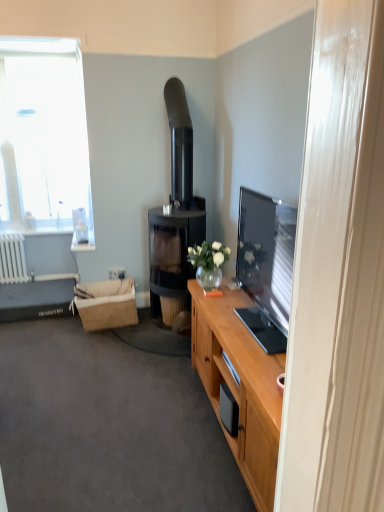
Locate an element on the screen. The image size is (384, 512). vacant space in front of burlap picnic basket at lower left is located at coordinates (100, 342).